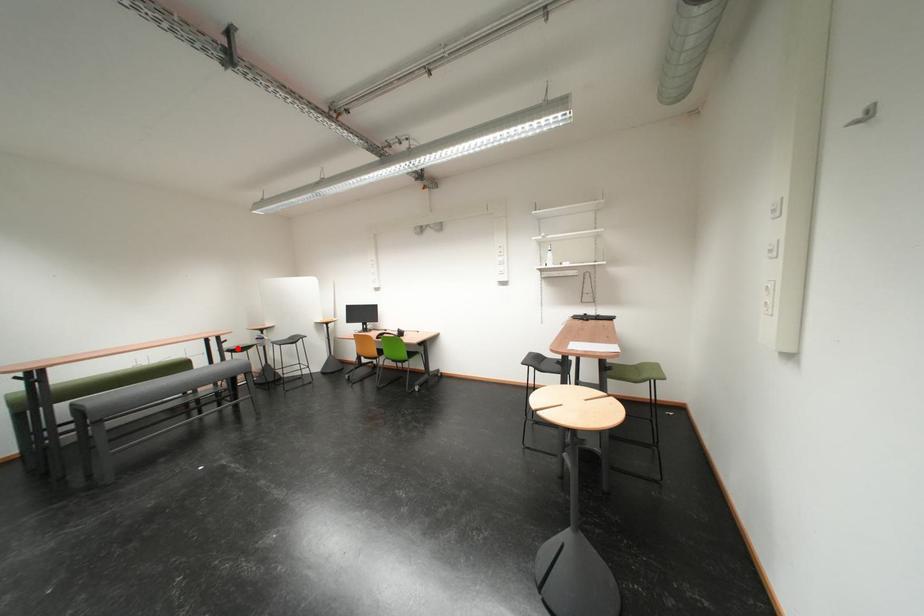
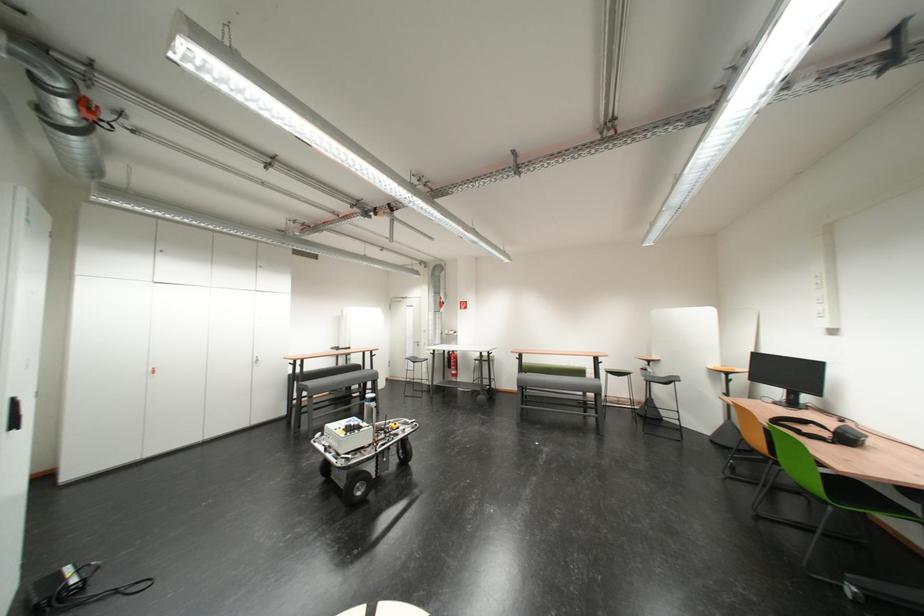
Find the pixel in the second image that matches the highlighted location in the first image.

(614, 369)